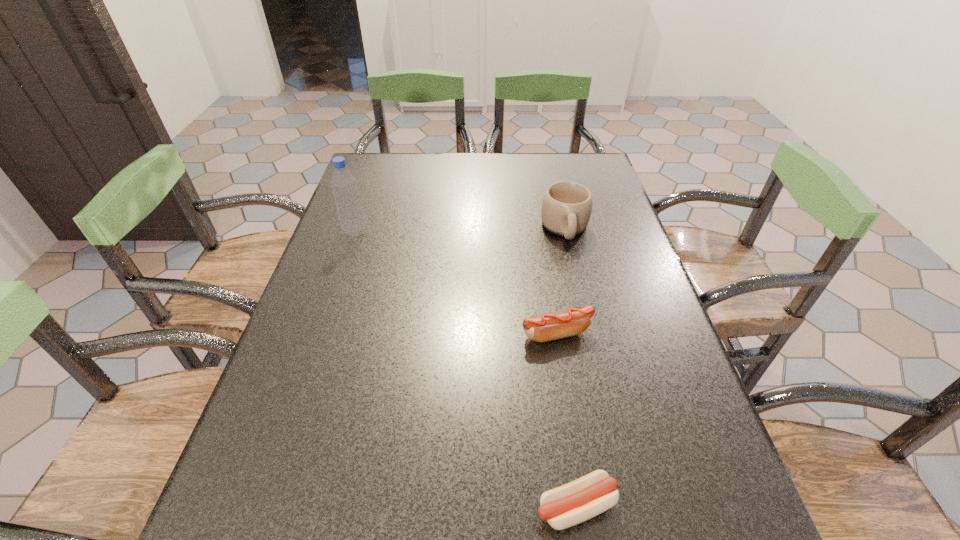
The image size is (960, 540). In order to click on the tallest object in this screenshot , I will do `click(348, 203)`.

You are a GUI agent. You are given a task and a screenshot of the screen. Output one action in this format:
    pyautogui.click(x=<x>, y=<y>)
    Task: Click on the leftmost object
    
    Given the screenshot: What is the action you would take?
    pyautogui.click(x=348, y=203)

This screenshot has height=540, width=960. Find the location of `mug`. mug is located at coordinates (566, 207).

Where is `the taller sausage`? The width and height of the screenshot is (960, 540). the taller sausage is located at coordinates (572, 321).

Find the location of `the second nearest object`. the second nearest object is located at coordinates (572, 321).

Find the location of a particular element. This screenshot has width=960, height=540. the shorter sausage is located at coordinates [584, 498].

At what (x,y) coordinates should I click in order to perform the action: click on the shortest object. Please return your answer as a coordinate pair (x, y). Looking at the image, I should click on (584, 498).

This screenshot has width=960, height=540. In order to click on vacant space situated on the front of the leftmost object in this screenshot , I will do `click(323, 327)`.

Find the location of `vacant space located 0.310m on the side of the third shortest object with the handle`. vacant space located 0.310m on the side of the third shortest object with the handle is located at coordinates (591, 342).

In order to click on vacant space located on the front of the third tallest object in this screenshot , I will do `click(573, 436)`.